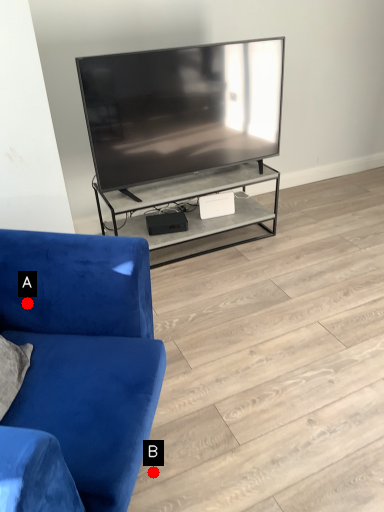
Question: Two points are circled on the image, labeled by A and B beside each circle. Which point is farther to the camera?

Choices:
 (A) A is further
 (B) B is further

Answer: (B)